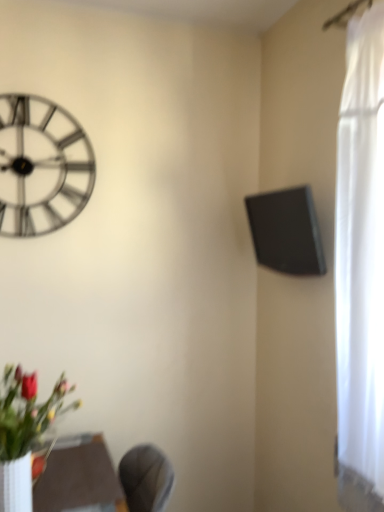
Question: Does metallic silver clock at upper left lie in front of black matte speaker at upper right?

Choices:
 (A) no
 (B) yes

Answer: (A)

Question: Can you confirm if metallic silver clock at upper left is smaller than black matte speaker at upper right?

Choices:
 (A) no
 (B) yes

Answer: (B)

Question: From a real-world perspective, is metallic silver clock at upper left beneath black matte speaker at upper right?

Choices:
 (A) yes
 (B) no

Answer: (B)

Question: Considering the relative positions of metallic silver clock at upper left and black matte speaker at upper right in the image provided, is metallic silver clock at upper left behind black matte speaker at upper right?

Choices:
 (A) no
 (B) yes

Answer: (B)

Question: Is metallic silver clock at upper left not close to black matte speaker at upper right?

Choices:
 (A) yes
 (B) no

Answer: (B)

Question: Are metallic silver clock at upper left and black matte speaker at upper right beside each other?

Choices:
 (A) no
 (B) yes

Answer: (A)

Question: Does black matte speaker at upper right have a greater width compared to matte brown table at lower center?

Choices:
 (A) no
 (B) yes

Answer: (A)

Question: Does black matte speaker at upper right have a lesser height compared to matte brown table at lower center?

Choices:
 (A) yes
 (B) no

Answer: (B)

Question: Is black matte speaker at upper right facing away from matte brown table at lower center?

Choices:
 (A) yes
 (B) no

Answer: (B)

Question: From a real-world perspective, does black matte speaker at upper right stand above matte brown table at lower center?

Choices:
 (A) yes
 (B) no

Answer: (A)

Question: Does black matte speaker at upper right come in front of matte brown table at lower center?

Choices:
 (A) no
 (B) yes

Answer: (A)

Question: Is black matte speaker at upper right to the left of matte brown table at lower center from the viewer's perspective?

Choices:
 (A) no
 (B) yes

Answer: (A)

Question: Does metallic silver clock at upper left have a smaller size compared to matte brown table at lower center?

Choices:
 (A) no
 (B) yes

Answer: (B)